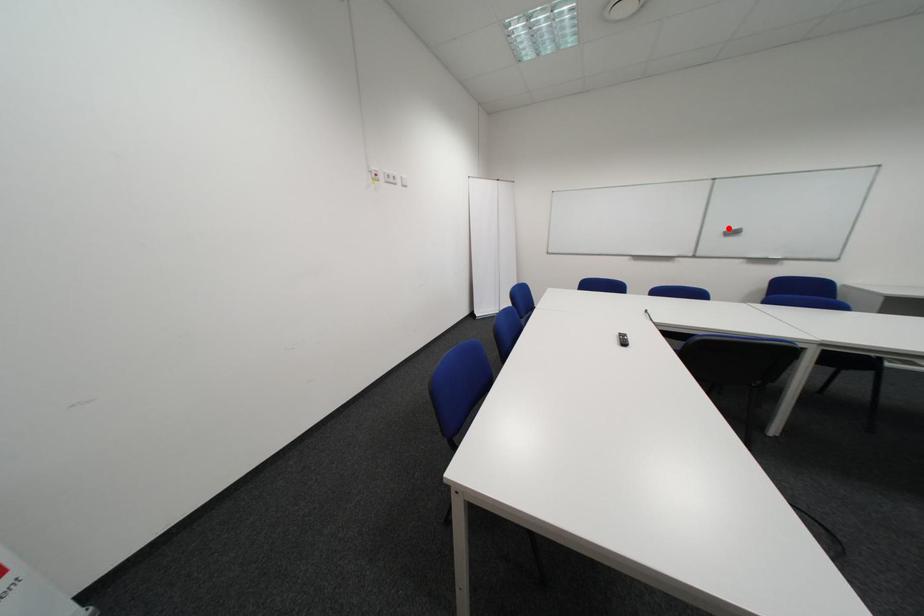
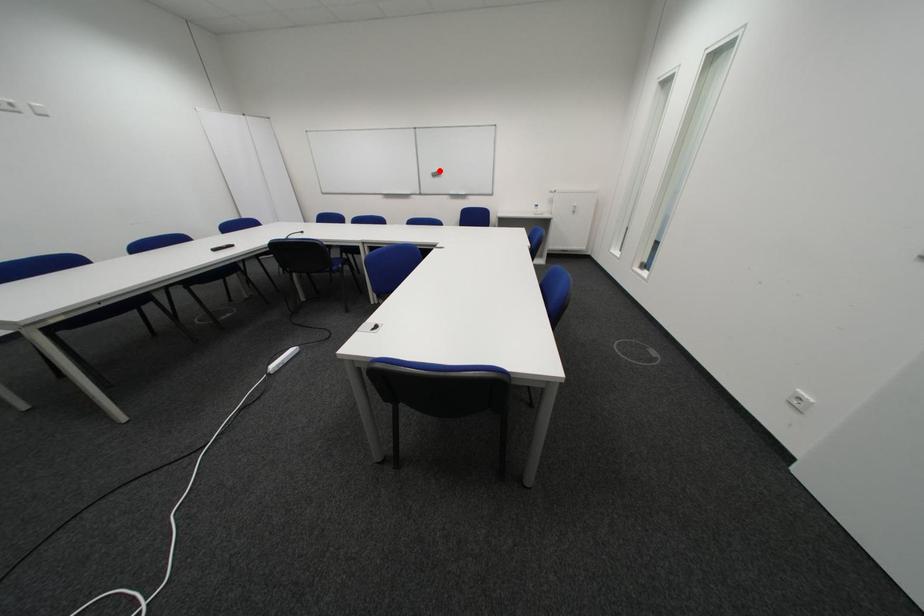
I am providing you with two images of the same scene from different viewpoints. A red point is marked on the first image and another point is marked on the second image. Are the points marked in image1 and image2 representing the same 3D position?

Yes